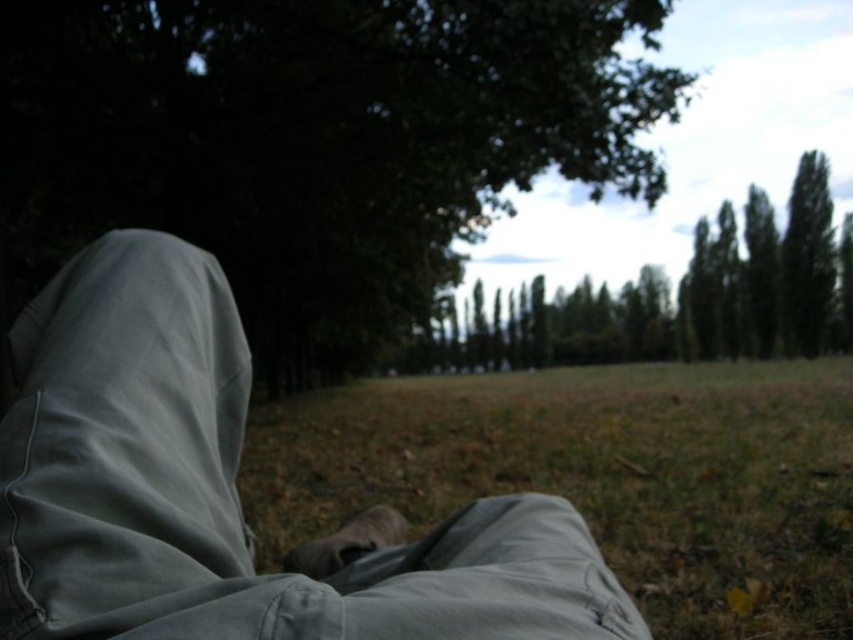
What do you see at coordinates (311, 145) in the screenshot? This screenshot has width=853, height=640. I see `green leafy tree at upper left` at bounding box center [311, 145].

Does green leafy tree at upper left appear on the left side of light gray pants at center?

Indeed, green leafy tree at upper left is positioned on the left side of light gray pants at center.

Describe the element at coordinates (311, 145) in the screenshot. I see `green leafy tree at upper left` at that location.

In order to click on green leafy tree at upper left in this screenshot , I will do `click(311, 145)`.

Who is lower down, green grass at lower center or green leafy tree at center?

green grass at lower center is lower down.

What are the coordinates of `green grass at lower center` in the screenshot? It's located at (599, 476).

Is light gray pants at center below green leafy tree at center?

Yes.

Is light gray pants at center further to the viewer compared to green leafy tree at center?

No, light gray pants at center is closer to the viewer.

Is point (561, 573) positioned after point (779, 328)?

No, (561, 573) is closer to viewer.

At what (x,y) coordinates should I click in order to perform the action: click on light gray pants at center. Please return your answer as a coordinate pair (x, y). This screenshot has height=640, width=853. Looking at the image, I should click on click(x=225, y=490).